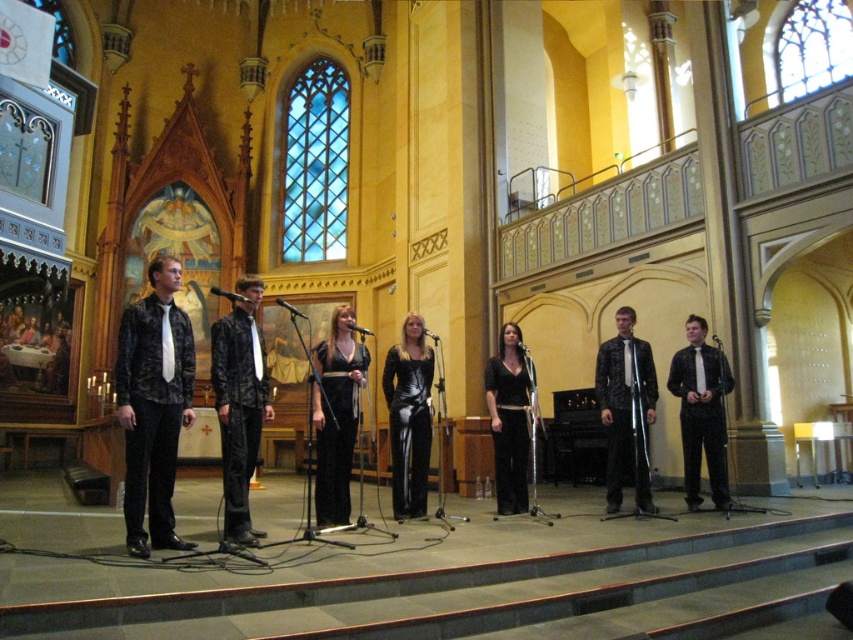
You are standing on the stage and want to move from the point at coordinates point (634, 348) to the point at coordinates point (718, 429). Which direction should you move to get there?

You should move forward because point (634, 348) is behind point (718, 429).

You are standing at the front of the stage in the church. You see two points marked on the stage floor. The first point is at coordinate point (x=155, y=468), and the second point is at coordinate point (x=231, y=486). Which point is closer to you?

The point at coordinate point (x=155, y=468) is closer to you because it is closer to the camera than point (x=231, y=486).

You are a photographer setting up for a group photo of the performers on stage. You need to ensure that the shiny black suit at center and the black textured shirt at right are both visible in the frame. Based on their positions, which performer should you position closer to the left side of the camera frame?

The shiny black suit at center should be positioned closer to the left side of the camera frame because it is on the left side of the black textured shirt at right.